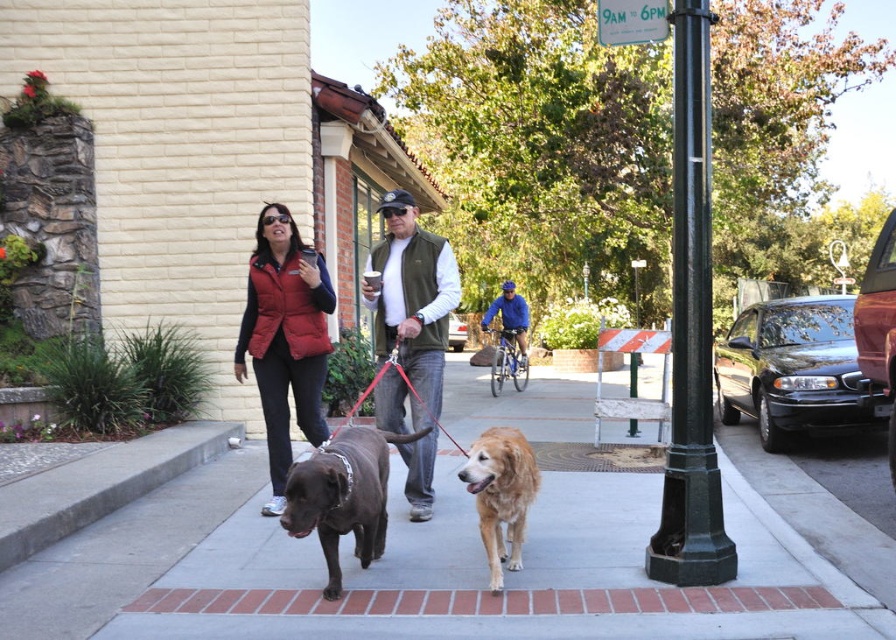
Is red puffy vest at center to the left of shiny brown dog at center from the viewer's perspective?

Indeed, red puffy vest at center is positioned on the left side of shiny brown dog at center.

Identify the location of red puffy vest at center. Image resolution: width=896 pixels, height=640 pixels. (285, 339).

Identify the location of red puffy vest at center. The height and width of the screenshot is (640, 896). (285, 339).

Consider the image. Does matte green vest at center have a greater height compared to shiny brown dog at center?

Indeed, matte green vest at center has a greater height compared to shiny brown dog at center.

Does matte green vest at center have a larger size compared to shiny brown dog at center?

Indeed, matte green vest at center has a larger size compared to shiny brown dog at center.

I want to click on matte green vest at center, so click(412, 326).

Between point (274, 237) and point (513, 288), which one is positioned behind?

Point (513, 288)

Which is in front, point (273, 324) or point (510, 317)?

Point (273, 324) is in front.

Find the location of a particular element. red puffy vest at center is located at coordinates (285, 339).